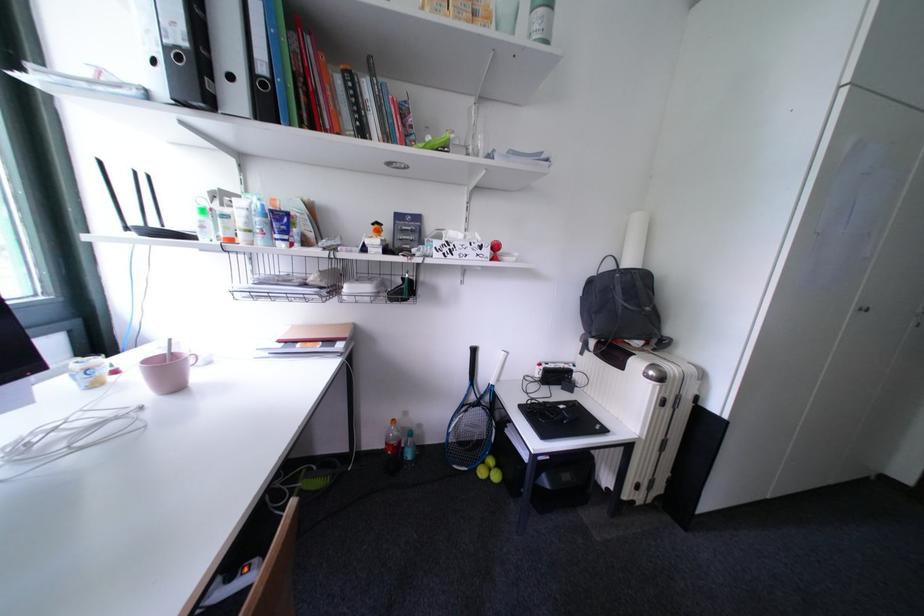
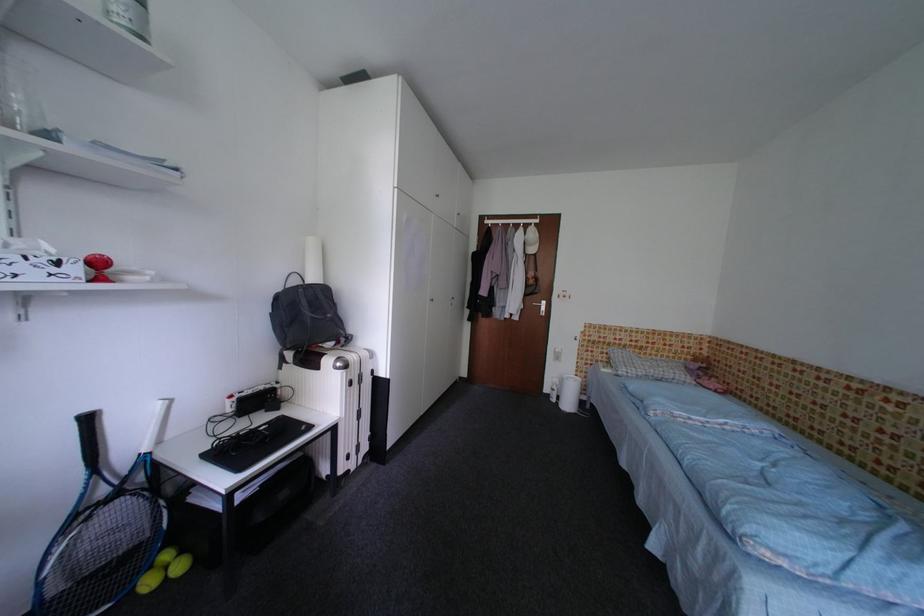
Find the pixel in the second image that matches the point at 505,468 in the first image.

(189, 554)